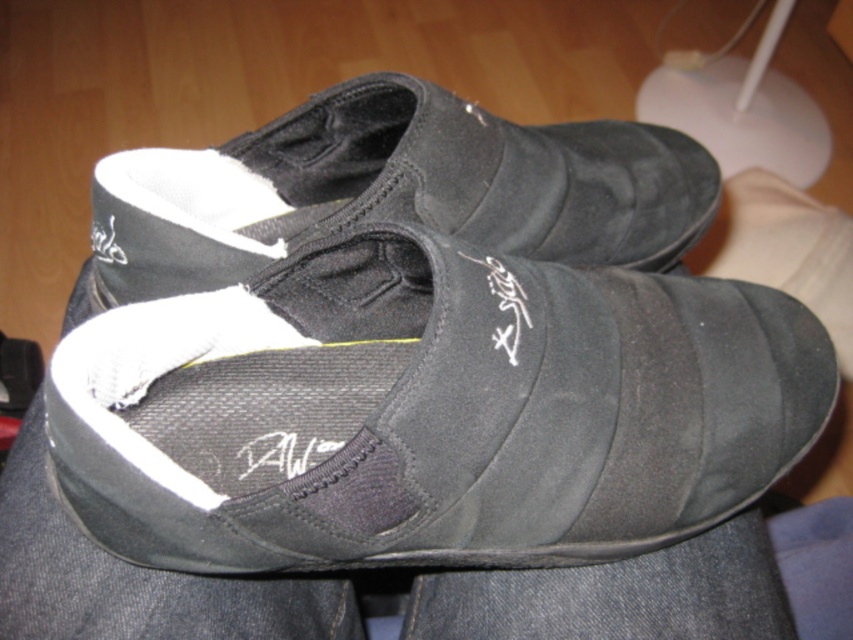
Question: Can you confirm if suede/black slip-on shoe at center is bigger than black suede shoe at center?

Choices:
 (A) no
 (B) yes

Answer: (A)

Question: Which of the following is the farthest from the observer?

Choices:
 (A) (318, 228)
 (B) (550, 374)

Answer: (A)

Question: Can you confirm if suede/black slip-on shoe at center is smaller than black suede shoe at center?

Choices:
 (A) yes
 (B) no

Answer: (A)

Question: Which of the following is the closest to the observer?

Choices:
 (A) (x=784, y=419)
 (B) (x=387, y=99)

Answer: (A)

Question: Does suede/black slip-on shoe at center appear on the right side of black suede shoe at center?

Choices:
 (A) no
 (B) yes

Answer: (B)